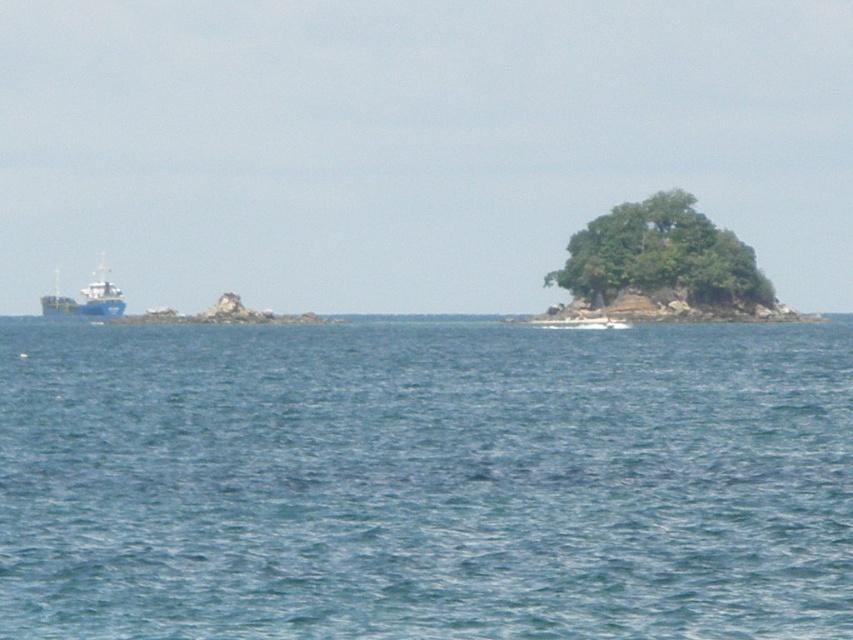
Question: Considering the relative positions of blue water at center and blue matte boat at left in the image provided, where is blue water at center located with respect to blue matte boat at left?

Choices:
 (A) left
 (B) right

Answer: (B)

Question: Considering the relative positions of blue water at center and green leafy island at center in the image provided, where is blue water at center located with respect to green leafy island at center?

Choices:
 (A) right
 (B) left

Answer: (B)

Question: Which point is closer to the camera taking this photo?

Choices:
 (A) 309,592
 (B) 660,218

Answer: (A)

Question: Based on their relative distances, which object is farther from the blue water at center?

Choices:
 (A) green leafy island at center
 (B) blue matte boat at left

Answer: (B)

Question: Estimate the real-world distances between objects in this image. Which object is farther from the green leafy island at center?

Choices:
 (A) blue matte boat at left
 (B) blue water at center

Answer: (A)

Question: Is green leafy island at center positioned at the back of blue matte boat at left?

Choices:
 (A) yes
 (B) no

Answer: (B)